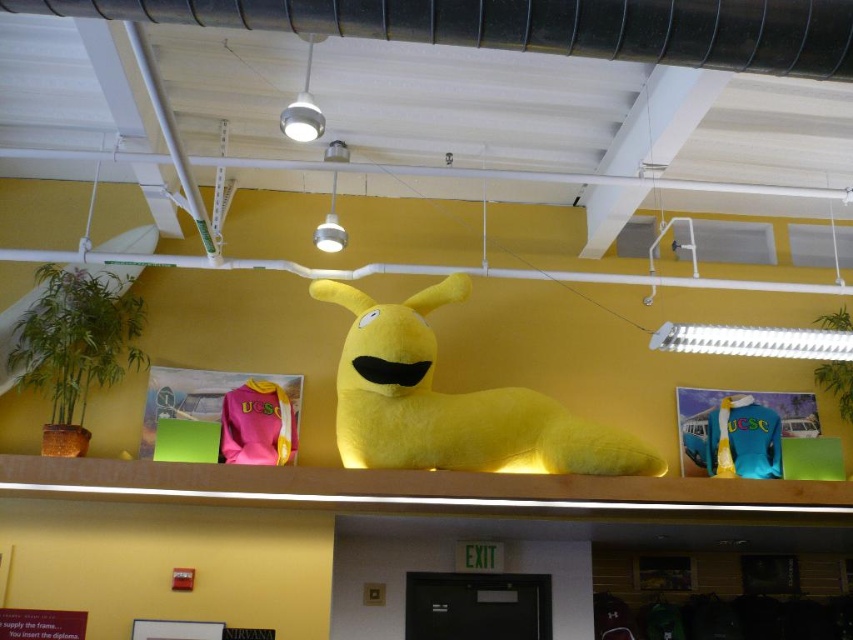
Is blue fabric shirt at upper center to the right of pink fleece sweatshirt at center from the viewer's perspective?

Yes, blue fabric shirt at upper center is to the right of pink fleece sweatshirt at center.

Is blue fabric shirt at upper center above pink fleece sweatshirt at center?

No, blue fabric shirt at upper center is not above pink fleece sweatshirt at center.

Between point (715, 470) and point (248, 435), which one is positioned behind?

The point (715, 470) is more distant.

At what (x,y) coordinates should I click in order to perform the action: click on blue fabric shirt at upper center. Please return your answer as a coordinate pair (x, y). This screenshot has width=853, height=640. Looking at the image, I should click on (735, 438).

Who is taller, matte yellow plush at center or blue fabric shirt at upper center?

With more height is matte yellow plush at center.

Is matte yellow plush at center wider than blue fabric shirt at upper center?

Yes.

Locate an element on the screen. The image size is (853, 640). matte yellow plush at center is located at coordinates (451, 403).

Is matte yellow plush at center positioned before pink fleece sweatshirt at center?

Yes, matte yellow plush at center is in front of pink fleece sweatshirt at center.

Between matte yellow plush at center and pink fleece sweatshirt at center, which one is positioned lower?

pink fleece sweatshirt at center

You are a GUI agent. You are given a task and a screenshot of the screen. Output one action in this format:
    pyautogui.click(x=<x>, y=<y>)
    Task: Click on the matte yellow plush at center
    The image size is (853, 640).
    Given the screenshot: What is the action you would take?
    pyautogui.click(x=451, y=403)

You are a GUI agent. You are given a task and a screenshot of the screen. Output one action in this format:
    pyautogui.click(x=<x>, y=<y>)
    Task: Click on the matte yellow plush at center
    
    Given the screenshot: What is the action you would take?
    pyautogui.click(x=451, y=403)